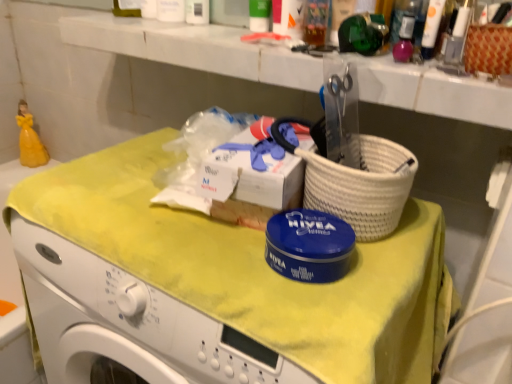
Question: Does yellow fabric at center have a greater height compared to translucent plastic cup at upper center, the second toiletry viewed from the right?

Choices:
 (A) no
 (B) yes

Answer: (B)

Question: Is yellow fabric at center with translucent plastic cup at upper center, the 2th toiletry in the front-to-back sequence?

Choices:
 (A) yes
 (B) no

Answer: (B)

Question: Is translucent plastic cup at upper center, the second toiletry viewed from the right, inside yellow fabric at center?

Choices:
 (A) no
 (B) yes

Answer: (A)

Question: From the image's perspective, does yellow fabric at center appear higher than translucent plastic cup at upper center, the second toiletry viewed from the right?

Choices:
 (A) no
 (B) yes

Answer: (A)

Question: Is yellow fabric at center thinner than translucent plastic cup at upper center, which ranks as the second toiletry in back-to-front order?

Choices:
 (A) yes
 (B) no

Answer: (B)

Question: From their relative heights in the image, would you say white glossy tube at upper right, the 1th toiletry when ordered from right to left, is taller or shorter than translucent plastic cup at upper center, the 2th toiletry viewed from the left?

Choices:
 (A) short
 (B) tall

Answer: (A)

Question: Visually, is white glossy tube at upper right, acting as the first toiletry starting from the front, positioned to the left or to the right of translucent plastic cup at upper center, the 2th toiletry in the front-to-back sequence?

Choices:
 (A) left
 (B) right

Answer: (B)

Question: Based on their sizes in the image, would you say white glossy tube at upper right, acting as the first toiletry starting from the front, is bigger or smaller than translucent plastic cup at upper center, the second toiletry viewed from the right?

Choices:
 (A) small
 (B) big

Answer: (A)

Question: Is white glossy tube at upper right, which is counted as the 3th toiletry, starting from the back, wider or thinner than translucent plastic cup at upper center, the second toiletry viewed from the right?

Choices:
 (A) thin
 (B) wide

Answer: (B)

Question: In terms of width, does yellow fabric at center look wider or thinner when compared to woven brown basket at upper right?

Choices:
 (A) wide
 (B) thin

Answer: (A)

Question: From a real-world perspective, is yellow fabric at center positioned above or below woven brown basket at upper right?

Choices:
 (A) below
 (B) above

Answer: (A)

Question: In terms of height, does yellow fabric at center look taller or shorter compared to woven brown basket at upper right?

Choices:
 (A) tall
 (B) short

Answer: (A)

Question: Considering the positions of point (36, 192) and point (472, 29), is point (36, 192) closer or farther from the camera than point (472, 29)?

Choices:
 (A) closer
 (B) farther

Answer: (B)

Question: Would you say woven brown basket at upper right is to the left or to the right of yellow fabric at center in the picture?

Choices:
 (A) left
 (B) right

Answer: (B)

Question: In terms of size, does woven brown basket at upper right appear bigger or smaller than yellow fabric at center?

Choices:
 (A) big
 (B) small

Answer: (B)